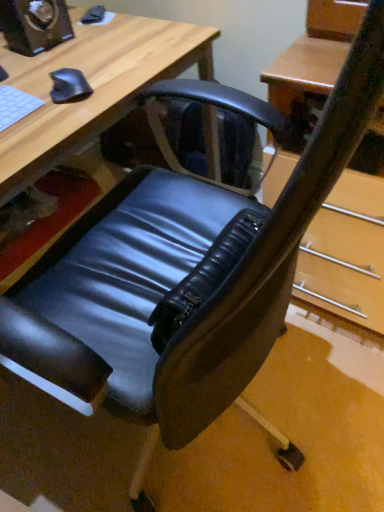
What is the approximate height of white matte keyboard at upper left?

It is 0.78 inches.

Image resolution: width=384 pixels, height=512 pixels. In order to click on white matte keyboard at upper left in this screenshot , I will do `click(15, 105)`.

This screenshot has width=384, height=512. In order to click on matte black chair at lower left in this screenshot , I will do `click(92, 88)`.

The height and width of the screenshot is (512, 384). In order to click on white matte keyboard at upper left in this screenshot , I will do `click(15, 105)`.

From a real-world perspective, does matte black speaker at upper left sit lower than matte black chair at lower left?

No, from a real-world perspective, matte black speaker at upper left is not below matte black chair at lower left.

Considering the sizes of objects matte black speaker at upper left and matte black chair at lower left in the image provided, who is thinner, matte black speaker at upper left or matte black chair at lower left?

matte black speaker at upper left is thinner.

Is matte black speaker at upper left next to matte black chair at lower left?

There is a gap between matte black speaker at upper left and matte black chair at lower left.

Based on the photo, from the image's perspective, is matte black speaker at upper left above or below matte black chair at lower left?

matte black speaker at upper left is above matte black chair at lower left.

Measure the distance from matte black speaker at upper left to black matte mouse at upper left.

The distance of matte black speaker at upper left from black matte mouse at upper left is 9.00 inches.

Which is behind, point (9, 37) or point (66, 81)?

The point (9, 37) is more distant.

Is matte black speaker at upper left inside the boundaries of black matte mouse at upper left, or outside?

matte black speaker at upper left cannot be found inside black matte mouse at upper left.

From a real-world perspective, is matte black speaker at upper left on black matte mouse at upper left?

Yes, from a real-world perspective, matte black speaker at upper left is above black matte mouse at upper left.

Does matte black chair at lower left have a lesser width compared to black matte mouse at upper left?

No.

Does matte black chair at lower left have a lesser height compared to black matte mouse at upper left?

→ No.

Is point (56, 52) positioned behind point (64, 75)?

Yes, point (56, 52) is farther from viewer.

From the image's perspective, would you say white matte keyboard at upper left is shown under matte black speaker at upper left?

Correct, white matte keyboard at upper left appears lower than matte black speaker at upper left in the image.

From a real-world perspective, who is located higher, white matte keyboard at upper left or matte black speaker at upper left?

matte black speaker at upper left.

Can you tell me how much white matte keyboard at upper left and matte black speaker at upper left differ in facing direction?

The angular difference between white matte keyboard at upper left and matte black speaker at upper left is 8.13 degrees.

Is white matte keyboard at upper left positioned before matte black speaker at upper left?

Yes, it is.

Do you think matte black chair at lower left is within white matte keyboard at upper left, or outside of it?

matte black chair at lower left is not enclosed by white matte keyboard at upper left.

Is white matte keyboard at upper left at the back of matte black chair at lower left?

No, matte black chair at lower left is not facing away from white matte keyboard at upper left.

Based on the photo, which is more to the right, matte black chair at lower left or white matte keyboard at upper left?

Positioned to the right is white matte keyboard at upper left.

Does point (55, 98) appear closer or farther from the camera than point (136, 83)?

Point (55, 98) is closer to the camera than point (136, 83).

Identify the location of desk on the left of the black matte mouse at upper left. The image size is (384, 512). (92, 88).

Measure the distance between black matte mouse at upper left and matte black chair at lower left.

black matte mouse at upper left and matte black chair at lower left are 6.21 inches apart from each other.

Which is more to the right, black matte mouse at upper left or matte black chair at lower left?

From the viewer's perspective, black matte mouse at upper left appears more on the right side.

Is white matte keyboard at upper left not close to black matte mouse at upper left?

No, white matte keyboard at upper left is not far away from black matte mouse at upper left.

Which object is thinner, white matte keyboard at upper left or black matte mouse at upper left?

black matte mouse at upper left.

Does point (25, 97) appear closer or farther from the camera than point (69, 72)?

Clearly, point (25, 97) is closer to the camera than point (69, 72).

Based on their sizes in the image, would you say white matte keyboard at upper left is bigger or smaller than black matte mouse at upper left?

→ white matte keyboard at upper left is bigger than black matte mouse at upper left.

You are a GUI agent. You are given a task and a screenshot of the screen. Output one action in this format:
    pyautogui.click(x=<x>, y=<y>)
    Task: Click on the speaker above the matte black chair at lower left (from the image's perspective)
    This screenshot has height=512, width=384.
    Given the screenshot: What is the action you would take?
    pyautogui.click(x=34, y=25)

Identify the location of speaker behind the black matte mouse at upper left. (34, 25).

When comparing their distances from white matte keyboard at upper left, does black matte mouse at upper left or matte black speaker at upper left seem closer?

Based on the image, black matte mouse at upper left appears to be nearer to white matte keyboard at upper left.

Considering their positions, is black matte mouse at upper left positioned further to matte black speaker at upper left than matte black chair at lower left?

black matte mouse at upper left is positioned further to the anchor matte black speaker at upper left.

From the image, which object appears to be nearer to matte black speaker at upper left, matte black chair at lower left or black matte mouse at upper left?

Based on the image, matte black chair at lower left appears to be nearer to matte black speaker at upper left.

Based on their spatial positions, is matte black speaker at upper left or white matte keyboard at upper left further from matte black chair at lower left?

white matte keyboard at upper left is positioned further to the anchor matte black chair at lower left.

Which object lies nearer to the anchor point black matte mouse at upper left, white matte keyboard at upper left or matte black chair at lower left?

white matte keyboard at upper left lies closer to black matte mouse at upper left than the other object.

Based on their spatial positions, is matte black speaker at upper left or matte black chair at lower left closer to white matte keyboard at upper left?

matte black chair at lower left is positioned closer to the anchor white matte keyboard at upper left.

Looking at the image, which one is located further to white matte keyboard at upper left, matte black chair at lower left or black matte mouse at upper left?

matte black chair at lower left lies further to white matte keyboard at upper left than the other object.

Looking at the image, which one is located closer to matte black speaker at upper left, white matte keyboard at upper left or black matte mouse at upper left?

black matte mouse at upper left is closer to matte black speaker at upper left.

I want to click on mouse between matte black speaker at upper left and matte black chair at lower left from top to bottom, so click(69, 86).

Find the location of `laptop keyboard between matte black speaker at upper left and matte black chair at lower left vertically`. laptop keyboard between matte black speaker at upper left and matte black chair at lower left vertically is located at coordinates (15, 105).

At what (x,y) coordinates should I click in order to perform the action: click on laptop keyboard between matte black chair at lower left and black matte mouse at upper left in the front-back direction. Please return your answer as a coordinate pair (x, y). The height and width of the screenshot is (512, 384). Looking at the image, I should click on (15, 105).

Find the location of `mouse that lies between matte black speaker at upper left and white matte keyboard at upper left from top to bottom`. mouse that lies between matte black speaker at upper left and white matte keyboard at upper left from top to bottom is located at coordinates (69, 86).